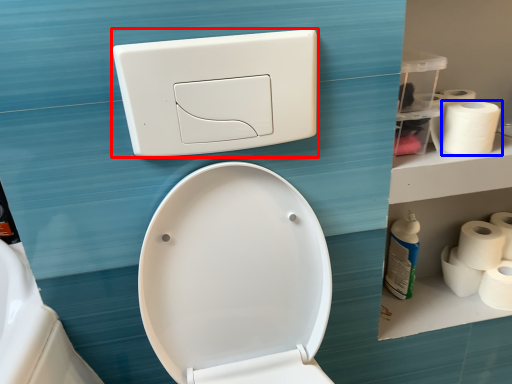
Question: Which of the following is the farthest to the observer, light switch (highlighted by a red box) or toilet paper (highlighted by a blue box)?

Choices:
 (A) light switch
 (B) toilet paper

Answer: (B)